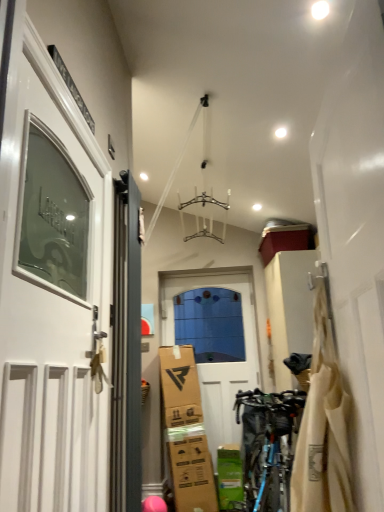
Question: Do you think white glossy door at left, the first door viewed from the front, is within beige fabric bag at right, or outside of it?

Choices:
 (A) inside
 (B) outside

Answer: (B)

Question: Considering the positions of point click(66, 122) and point click(327, 392), is point click(66, 122) closer or farther from the camera than point click(327, 392)?

Choices:
 (A) closer
 (B) farther

Answer: (B)

Question: Which is farther from the green cardboard box at lower center?

Choices:
 (A) blue metallic bicycle at lower right
 (B) beige fabric bag at right
 (C) matte gray door at left, marked as the second door in a left-to-right arrangement
 (D) white matte door at center, the first door positioned from the back
 (E) white glossy door at left, the 3th door positioned from the right

Answer: (E)

Question: Which of these objects is positioned farthest from the white matte door at center, the first door positioned from the right?

Choices:
 (A) blue metallic bicycle at lower right
 (B) green cardboard box at lower center
 (C) white glossy door at left, the 3th door positioned from the right
 (D) beige fabric bag at right
 (E) matte gray door at left, positioned as the 2th door in front-to-back order

Answer: (C)